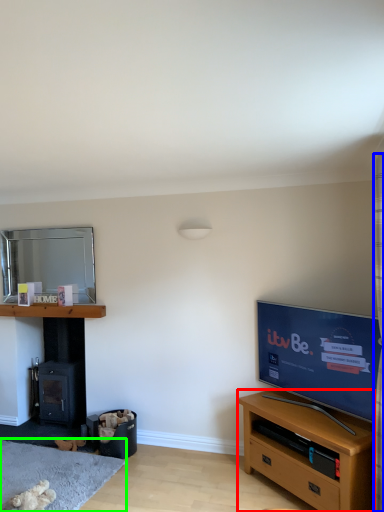
Question: Considering the real-world distances, which object is farthest from cabinetry (highlighted by a red box)? curtain (highlighted by a blue box) or plain (highlighted by a green box)?

Choices:
 (A) curtain
 (B) plain

Answer: (B)